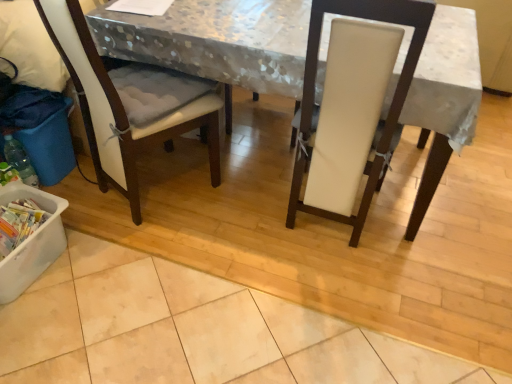
Where is `vacant space to the right of translucent plastic bottle at lower left`? The image size is (512, 384). vacant space to the right of translucent plastic bottle at lower left is located at coordinates (75, 192).